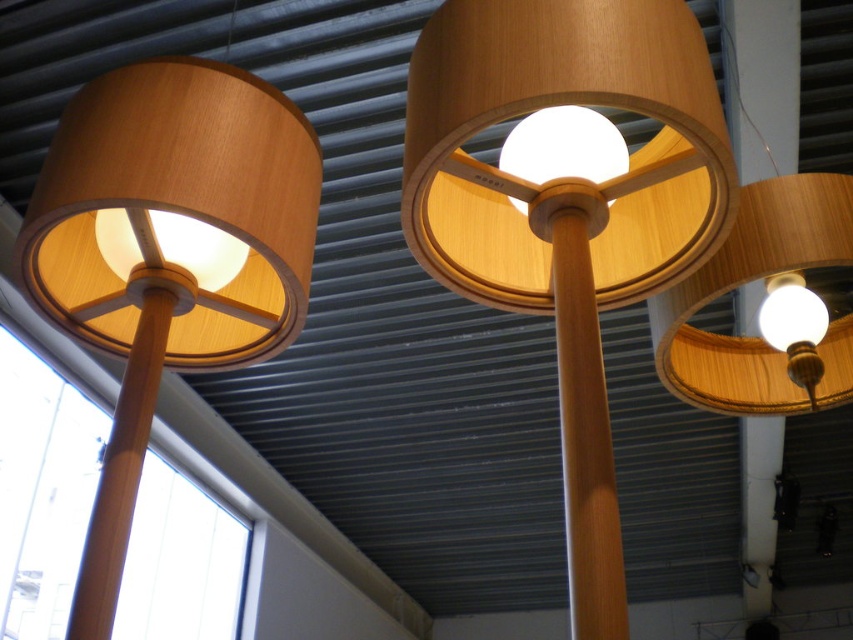
Question: Which object is closer to the camera taking this photo?

Choices:
 (A) wooden lampshade at center
 (B) wooden lampshade at upper right
 (C) matte wood lampshade at center

Answer: (A)

Question: Which point appears closest to the camera in this image?

Choices:
 (A) (764, 292)
 (B) (709, 260)
 (C) (611, 474)

Answer: (C)

Question: Does wooden lampshade at center appear over matte white globe at right?

Choices:
 (A) yes
 (B) no

Answer: (A)

Question: Which of the following is the farthest from the observer?

Choices:
 (A) wooden pole at center
 (B) matte white globe at right
 (C) wooden lampshade at center
 (D) matte wood lampshade at center

Answer: (B)

Question: Can you confirm if wooden pole at center is positioned below matte white globe at right?

Choices:
 (A) no
 (B) yes

Answer: (B)

Question: Is wooden lampshade at upper right below wooden pole at left?

Choices:
 (A) yes
 (B) no

Answer: (B)